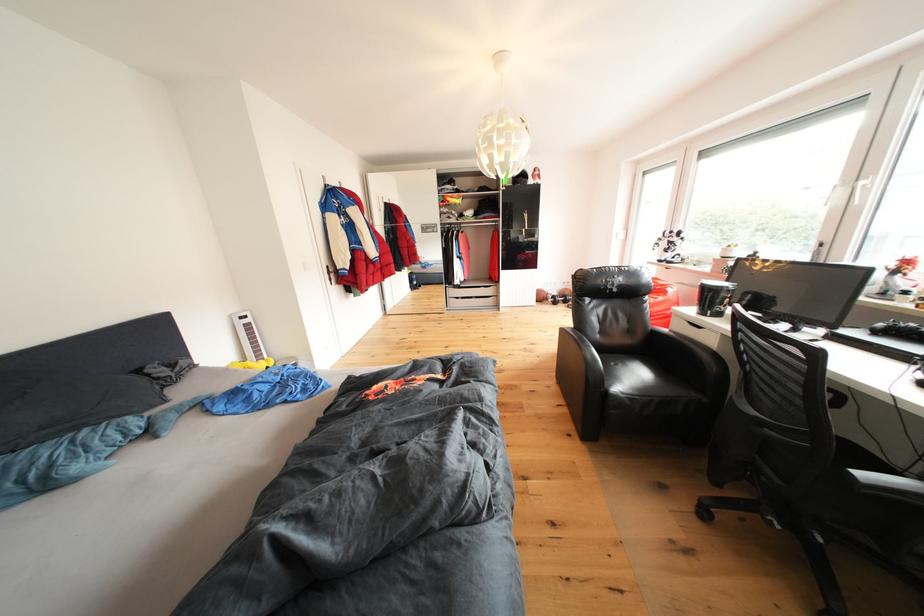
At what (x,y) coordinates should I click in order to perform the action: click on white tower fan. Please return your answer as a coordinate pair (x, y). The image size is (924, 616). Looking at the image, I should click on (249, 336).